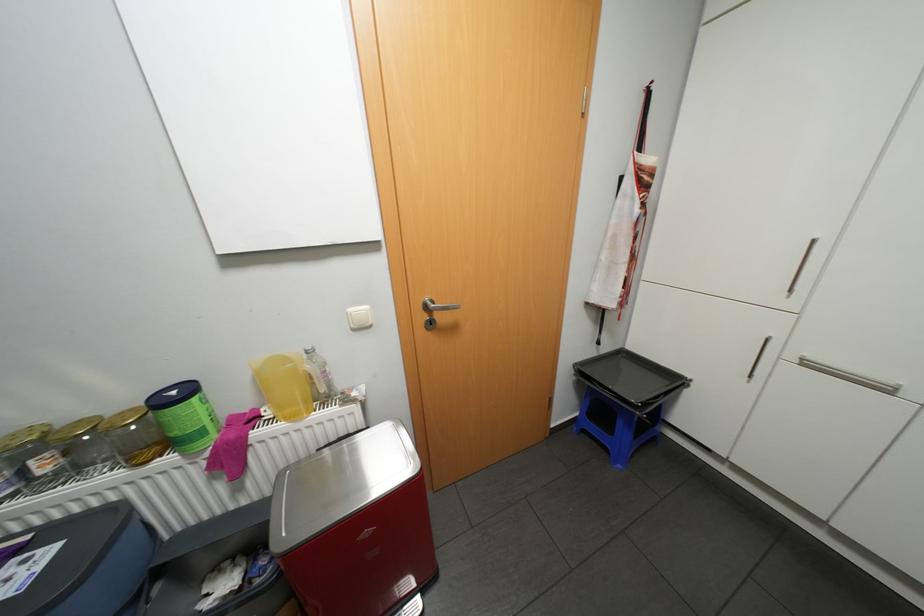
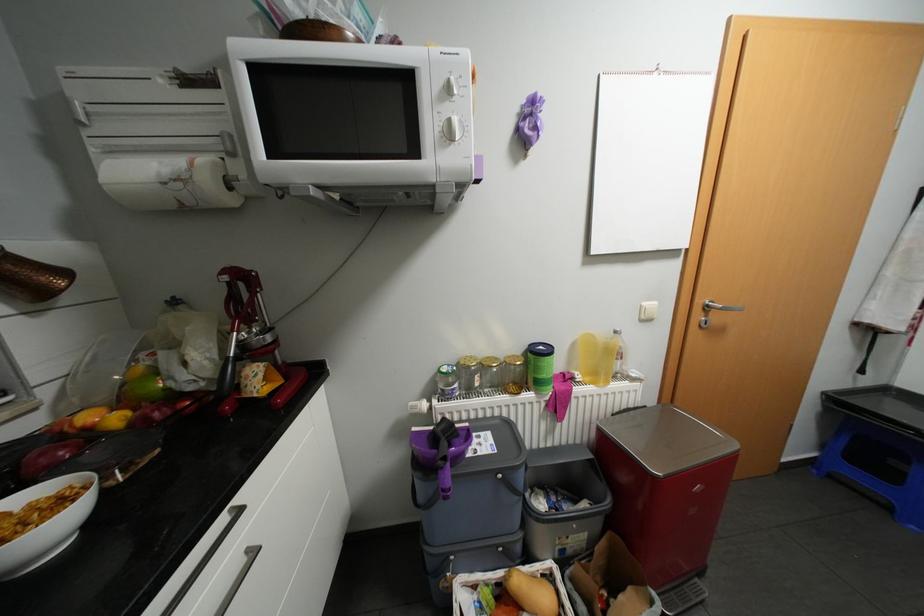
The point at (190, 453) is marked in the first image. Where is the corresponding point in the second image?

(544, 392)